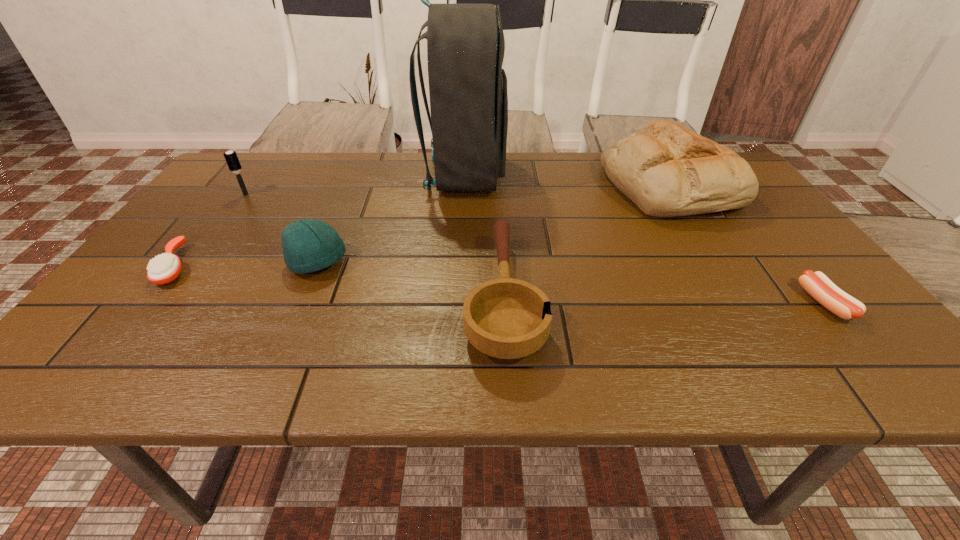
Image resolution: width=960 pixels, height=540 pixels. I want to click on vacant area situated 0.100m on the front of the bread, so click(707, 248).

Locate an element on the screen. Image resolution: width=960 pixels, height=540 pixels. free space located 0.380m on the right of the taller hairbrush is located at coordinates (383, 194).

Find the location of a particular element. vacant space located 0.100m on the front of the beanie is located at coordinates (296, 315).

Locate an element on the screen. blank space located 0.170m with the handle on the side of the fifth tallest object is located at coordinates (498, 205).

The width and height of the screenshot is (960, 540). What are the coordinates of `vacant region located 0.180m with the handle on the side of the fifth tallest object` in the screenshot? It's located at (498, 203).

Identify the location of vacant region located with the handle on the side of the fifth tallest object. (498, 203).

Image resolution: width=960 pixels, height=540 pixels. I want to click on vacant space located 0.190m on the right of the nearer hairbrush, so click(273, 266).

Where is `free region located on the back of the sausage`? The height and width of the screenshot is (540, 960). free region located on the back of the sausage is located at coordinates (744, 204).

Identify the location of backpack that is positioned at the far edge. (465, 42).

Locate an element on the screen. The width and height of the screenshot is (960, 540). bread that is positioned at the far edge is located at coordinates (666, 170).